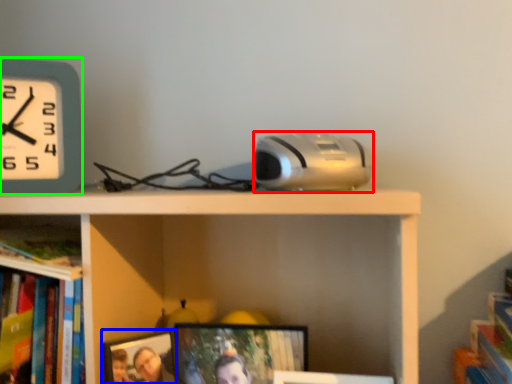
Question: Which object is positioned farthest from gadget (highlighted by a red box)? Select from picture frame (highlighted by a blue box) and wall clock (highlighted by a green box).

Choices:
 (A) picture frame
 (B) wall clock

Answer: (B)